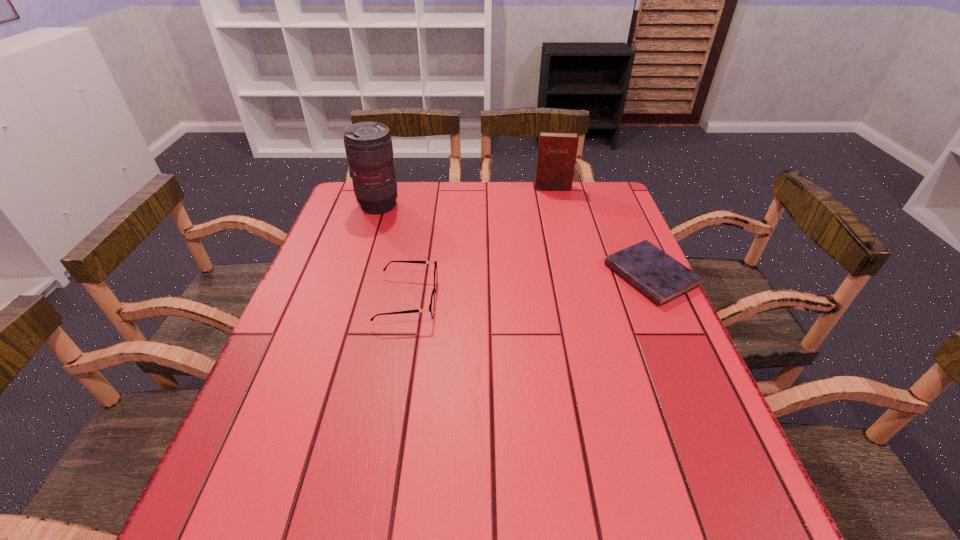
You are a GUI agent. You are given a task and a screenshot of the screen. Output one action in this format:
    pyautogui.click(x=<x>, y=<y>)
    Task: Click on the object located in the far right corner section of the desktop
    
    Given the screenshot: What is the action you would take?
    pyautogui.click(x=557, y=151)

The width and height of the screenshot is (960, 540). In the image, there is a desktop. What are the coordinates of `vacant space at the far edge` in the screenshot? It's located at (462, 197).

In the image, there is a desktop. Where is `vacant space at the near edge`? vacant space at the near edge is located at coordinates (493, 431).

Locate an element on the screen. Image resolution: width=960 pixels, height=540 pixels. free space at the left edge of the desktop is located at coordinates (363, 281).

Where is `vacant area at the right edge`? This screenshot has width=960, height=540. vacant area at the right edge is located at coordinates (627, 234).

Locate an element on the screen. The width and height of the screenshot is (960, 540). blank area at the far right corner is located at coordinates (611, 218).

Where is `free point between the spectacles and the shortest object`? This screenshot has height=540, width=960. free point between the spectacles and the shortest object is located at coordinates (529, 288).

Where is `empty location between the second object from left to right and the farthest object`? The height and width of the screenshot is (540, 960). empty location between the second object from left to right and the farthest object is located at coordinates 480,244.

Find the location of a particular element. unoccupied position between the second object from left to right and the farther diary is located at coordinates (480, 244).

Find the location of `free space between the third tallest object and the second object from right to left`. free space between the third tallest object and the second object from right to left is located at coordinates (480, 244).